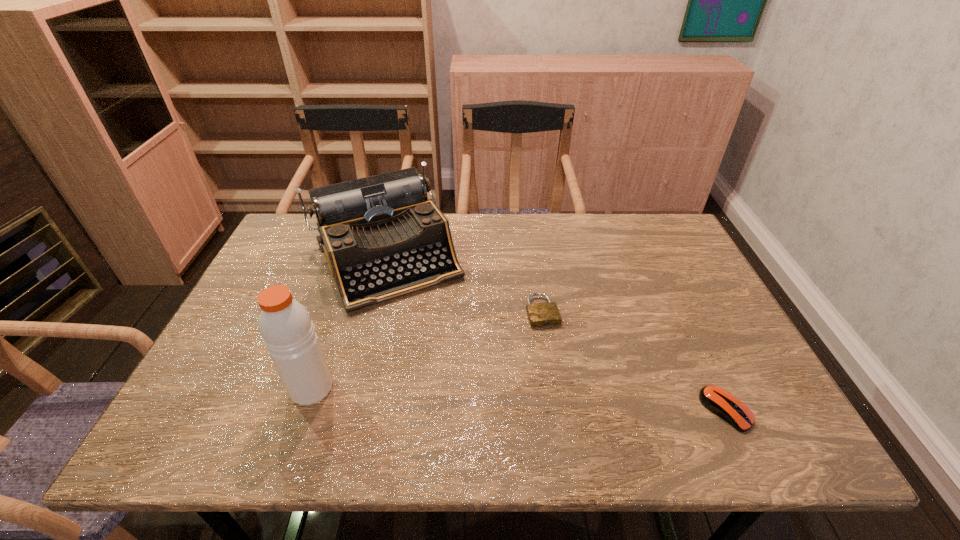
Identify the location of free space located 0.120m on the keyhole side of the second object from right to left. The width and height of the screenshot is (960, 540). (560, 366).

Locate an element on the screen. free space located on the keyboard of the third shortest object is located at coordinates (419, 322).

Locate an element on the screen. Image resolution: width=960 pixels, height=540 pixels. vacant area situated 0.270m on the keyboard of the third shortest object is located at coordinates (453, 388).

The image size is (960, 540). Find the location of `vacant space located 0.310m on the keyboard of the third shortest object`. vacant space located 0.310m on the keyboard of the third shortest object is located at coordinates (460, 402).

In order to click on object located in the far edge section of the desktop in this screenshot , I will do `click(382, 238)`.

You are a GUI agent. You are given a task and a screenshot of the screen. Output one action in this format:
    pyautogui.click(x=<x>, y=<y>)
    Task: Click on the shaker that is positioned at the near edge
    The image size is (960, 540).
    Given the screenshot: What is the action you would take?
    pyautogui.click(x=285, y=325)

Find the location of a particular element. The height and width of the screenshot is (540, 960). computer mouse located in the near edge section of the desktop is located at coordinates (720, 402).

Where is `object located in the left edge section of the desktop`? The width and height of the screenshot is (960, 540). object located in the left edge section of the desktop is located at coordinates (382, 238).

You are a GUI agent. You are given a task and a screenshot of the screen. Output one action in this format:
    pyautogui.click(x=<x>, y=<y>)
    Task: Click on the object that is at the right edge
    The image size is (960, 540).
    Given the screenshot: What is the action you would take?
    pyautogui.click(x=720, y=402)

Image resolution: width=960 pixels, height=540 pixels. What are the coordinates of `object that is at the far left corner` in the screenshot? It's located at point(382,238).